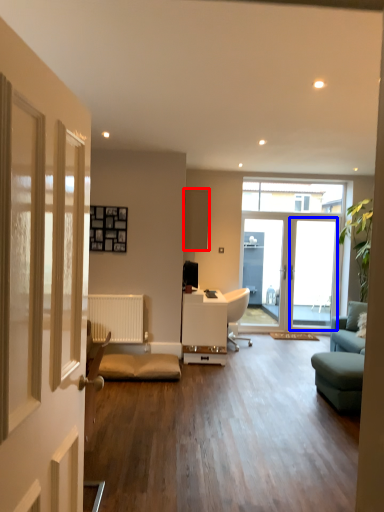
Question: Which point is closer to the camera, cabinetry (highlighted by a red box) or screen door (highlighted by a blue box)?

Choices:
 (A) cabinetry
 (B) screen door

Answer: (A)